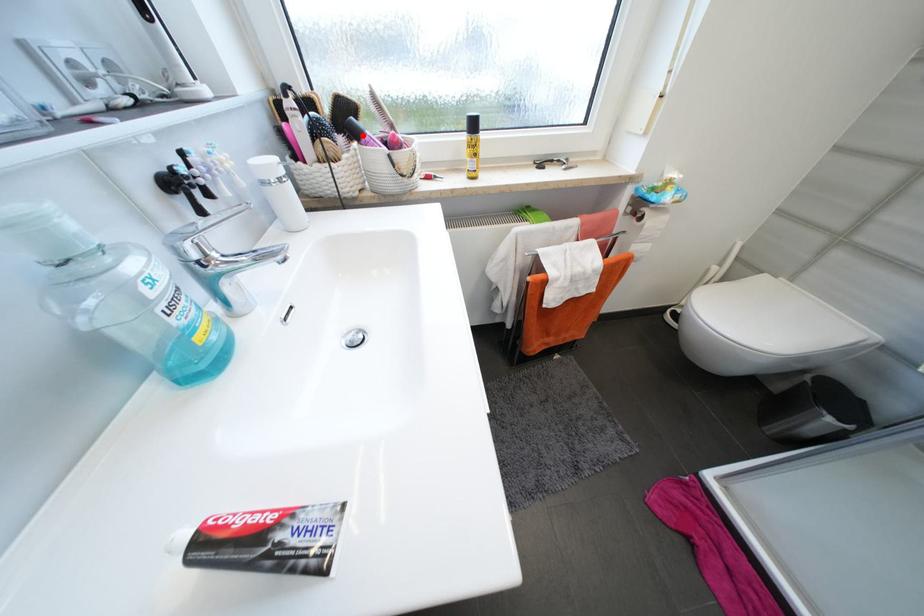
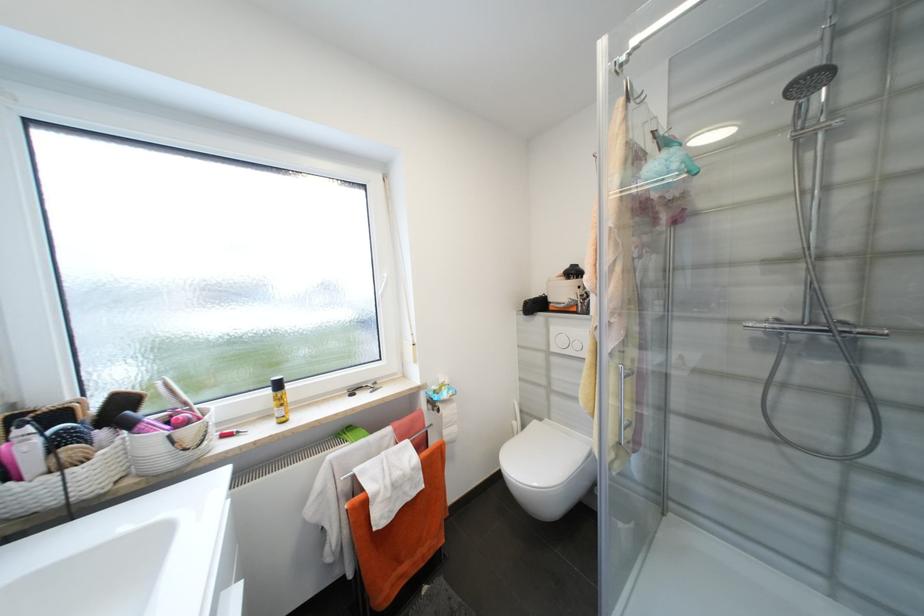
Find the pixel in the second image that matches the highlighted location in the first image.

(134, 427)